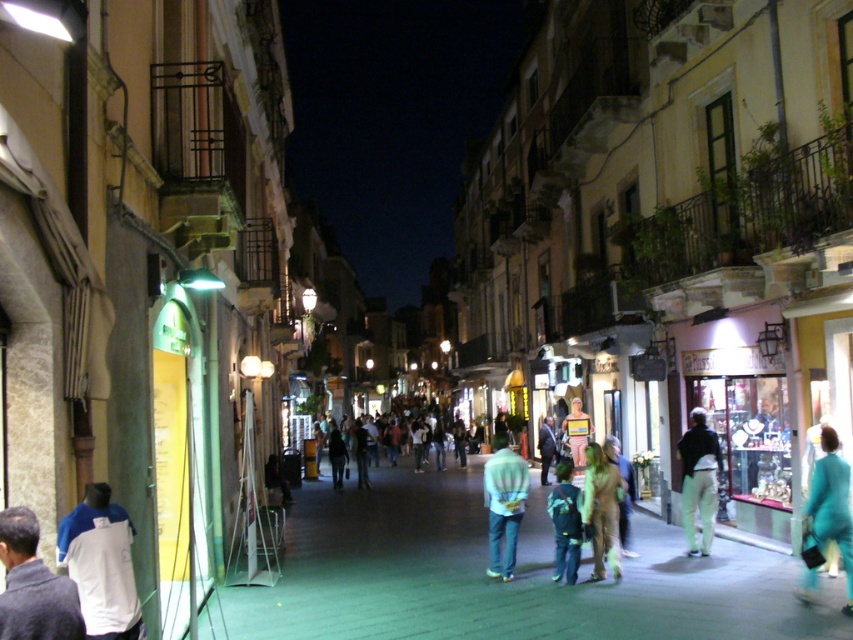
Question: Which point is closer to the camera?

Choices:
 (A) (554, 554)
 (B) (805, 573)
 (C) (490, 522)

Answer: (B)

Question: Which object is closer to the camera taking this photo?

Choices:
 (A) white jersey at lower left
 (B) green denim jacket at center

Answer: (A)

Question: In this image, where is teal fabric coat at lower right located relative to green matte costume at center?

Choices:
 (A) right
 (B) left

Answer: (A)

Question: Is white jersey at lower left in front of green denim jacket at center?

Choices:
 (A) no
 (B) yes

Answer: (B)

Question: Does dark gray sweater at lower left appear on the left side of light beige pants at center right?

Choices:
 (A) no
 (B) yes

Answer: (B)

Question: Based on their relative distances, which object is farther from the dark blue jeans at center?

Choices:
 (A) teal fabric coat at lower right
 (B) dark gray sweater at lower left

Answer: (B)